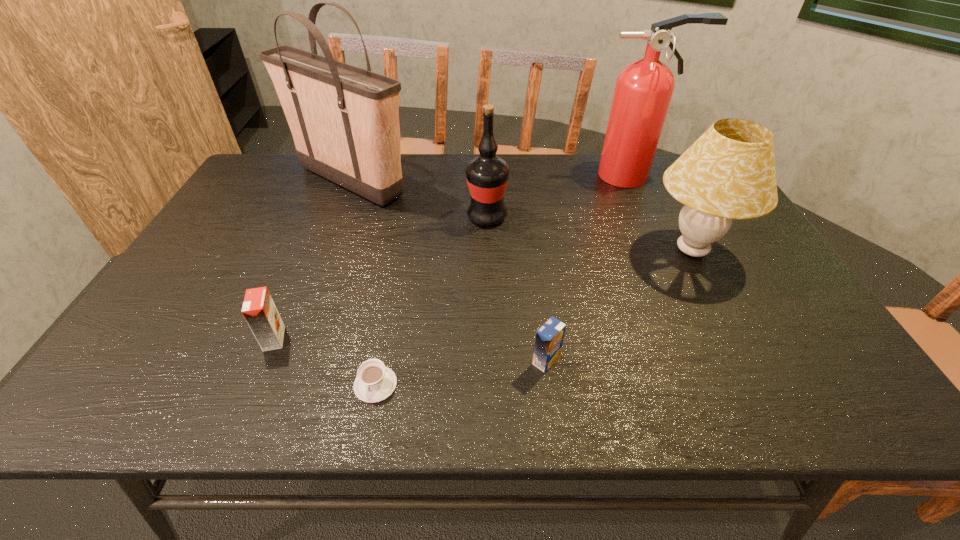
Find the location of a particular element. The width and height of the screenshot is (960, 540). vacant space located 0.280m on the front of the fire extinguisher is located at coordinates (665, 246).

Where is `vacant region located 0.250m on the left of the lampshade`? The image size is (960, 540). vacant region located 0.250m on the left of the lampshade is located at coordinates (552, 250).

Find the location of a particular element. free region located on the front of the wine bottle is located at coordinates (489, 296).

What are the coordinates of `free space located 0.110m on the front of the taller orange_juice` in the screenshot? It's located at (250, 397).

Identify the location of free region located 0.270m on the back of the third object from right to left. (534, 265).

Identify the location of shopping bag located in the far edge section of the desktop. Image resolution: width=960 pixels, height=540 pixels. (344, 120).

Where is `fire extinguisher that is at the far edge`? Image resolution: width=960 pixels, height=540 pixels. fire extinguisher that is at the far edge is located at coordinates [643, 91].

At what (x,y) coordinates should I click in order to perform the action: click on object present at the near edge. Please return your answer as a coordinate pair (x, y). The height and width of the screenshot is (540, 960). Looking at the image, I should click on (375, 382).

Identify the location of object at the left edge. (344, 120).

Find the location of a particular element. This screenshot has width=960, height=540. fire extinguisher at the right edge is located at coordinates (643, 91).